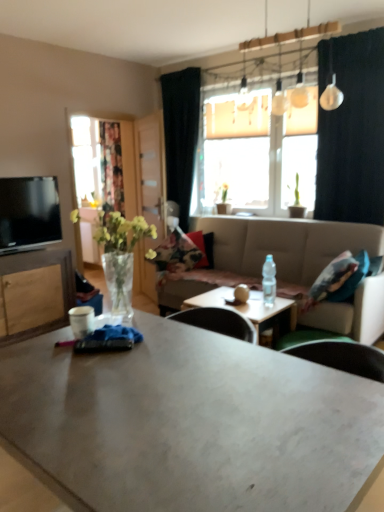
Question: Considering the relative sizes of floral-patterned fabric pillow at center and matte gray coffee table at center, which appears as the second coffee table when viewed from the back, in the image provided, is floral-patterned fabric pillow at center wider than matte gray coffee table at center, which appears as the second coffee table when viewed from the back,?

Choices:
 (A) no
 (B) yes

Answer: (A)

Question: Considering the relative sizes of floral-patterned fabric pillow at center and matte gray coffee table at center, which appears as the second coffee table when viewed from the back, in the image provided, is floral-patterned fabric pillow at center shorter than matte gray coffee table at center, which appears as the second coffee table when viewed from the back,?

Choices:
 (A) yes
 (B) no

Answer: (A)

Question: Considering the relative sizes of floral-patterned fabric pillow at center and matte gray coffee table at center, which appears as the second coffee table when viewed from the back, in the image provided, is floral-patterned fabric pillow at center smaller than matte gray coffee table at center, which appears as the second coffee table when viewed from the back,?

Choices:
 (A) no
 (B) yes

Answer: (B)

Question: Is floral-patterned fabric pillow at center oriented towards matte gray coffee table at center, which appears as the second coffee table when viewed from the back?

Choices:
 (A) yes
 (B) no

Answer: (A)

Question: Considering the relative sizes of floral-patterned fabric pillow at center and matte gray coffee table at center, which appears as the second coffee table when viewed from the back, in the image provided, is floral-patterned fabric pillow at center bigger than matte gray coffee table at center, which appears as the second coffee table when viewed from the back,?

Choices:
 (A) yes
 (B) no

Answer: (B)

Question: Is clear plastic bottle at center in front of or behind clear glass vase at left in the image?

Choices:
 (A) behind
 (B) front

Answer: (A)

Question: From a real-world perspective, is clear plastic bottle at center positioned above or below clear glass vase at left?

Choices:
 (A) below
 (B) above

Answer: (A)

Question: Visually, is clear plastic bottle at center positioned to the left or to the right of clear glass vase at left?

Choices:
 (A) left
 (B) right

Answer: (B)

Question: Considering the positions of clear plastic bottle at center and clear glass vase at left in the image, is clear plastic bottle at center wider or thinner than clear glass vase at left?

Choices:
 (A) wide
 (B) thin

Answer: (B)

Question: In the image, is transparent glass door at center on the left side or the right side of black fabric curtain at upper right, arranged as the second curtain when viewed from the left?

Choices:
 (A) right
 (B) left

Answer: (B)

Question: In terms of width, does transparent glass door at center look wider or thinner when compared to black fabric curtain at upper right, arranged as the second curtain when viewed from the left?

Choices:
 (A) thin
 (B) wide

Answer: (B)

Question: From the image's perspective, relative to black fabric curtain at upper right, the 2th curtain from the back, is transparent glass door at center above or below?

Choices:
 (A) above
 (B) below

Answer: (B)

Question: Does point (155, 142) appear closer or farther from the camera than point (339, 61)?

Choices:
 (A) farther
 (B) closer

Answer: (A)

Question: Is matte gray coffee table at center, the 1th coffee table in the front-to-back sequence, taller or shorter than floral fabric curtain at left?

Choices:
 (A) tall
 (B) short

Answer: (B)

Question: Is point (263, 451) closer or farther from the camera than point (89, 251)?

Choices:
 (A) closer
 (B) farther

Answer: (A)